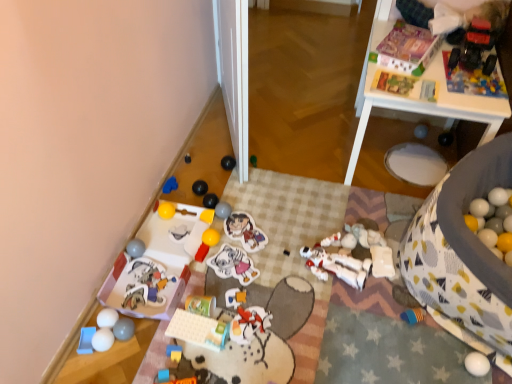
Locate an element on the screen. vacant space to the right of matte plastic sticker at center, the seventh toy when ordered from right to left is located at coordinates (287, 236).